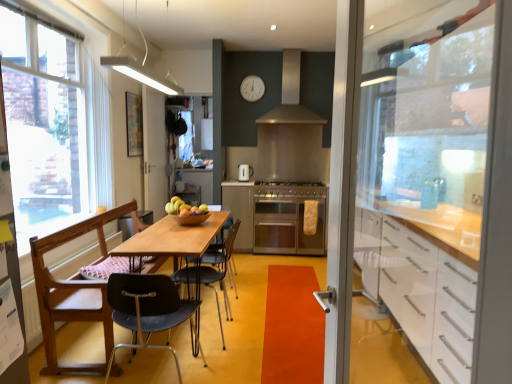
This screenshot has height=384, width=512. In order to click on unoccupied area behind black plastic chair at center, which is the 1th chair from back to front in this screenshot , I will do `click(226, 306)`.